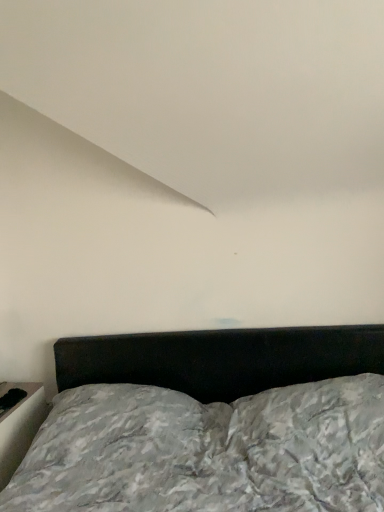
Describe the element at coordinates (211, 423) in the screenshot. I see `textured gray bed at center` at that location.

Measure the distance between textured gray bed at center and camera.

They are 4.44 feet apart.

You are a GUI agent. You are given a task and a screenshot of the screen. Output one action in this format:
    pyautogui.click(x=<x>, y=<y>)
    Task: Click on the textured gray bed at center
    
    Given the screenshot: What is the action you would take?
    pyautogui.click(x=211, y=423)

This screenshot has width=384, height=512. What do you see at coordinates (19, 426) in the screenshot?
I see `white glossy table at lower left` at bounding box center [19, 426].

Identify the location of white glossy table at lower left. This screenshot has width=384, height=512. (19, 426).

The width and height of the screenshot is (384, 512). In order to click on textured gray bed at center in this screenshot , I will do `click(211, 423)`.

Is white glossy table at lower left at the right side of textured gray bed at center?

Incorrect, white glossy table at lower left is not on the right side of textured gray bed at center.

Considering the relative positions of white glossy table at lower left and textured gray bed at center in the image provided, is white glossy table at lower left in front of textured gray bed at center?

No.

Does point (38, 420) come closer to viewer compared to point (344, 354)?

That is False.

From the image's perspective, is white glossy table at lower left over textured gray bed at center?

No, from the image's perspective, white glossy table at lower left is not above textured gray bed at center.

From a real-world perspective, is white glossy table at lower left under textured gray bed at center?

Yes, from a real-world perspective, white glossy table at lower left is beneath textured gray bed at center.

Consider the image. Is white glossy table at lower left wider or thinner than textured gray bed at center?

white glossy table at lower left is thinner than textured gray bed at center.

In terms of height, does white glossy table at lower left look taller or shorter compared to textured gray bed at center?

white glossy table at lower left is shorter than textured gray bed at center.

Between white glossy table at lower left and textured gray bed at center, which one has smaller size?

white glossy table at lower left is smaller.

Is white glossy table at lower left positioned beyond the bounds of textured gray bed at center?

Indeed, white glossy table at lower left is completely outside textured gray bed at center.

Consider the image. Is white glossy table at lower left touching textured gray bed at center?

There is a gap between white glossy table at lower left and textured gray bed at center.

Is white glossy table at lower left oriented towards textured gray bed at center?

No, white glossy table at lower left is not facing towards textured gray bed at center.

Where is `table behind the textured gray bed at center`? The height and width of the screenshot is (512, 384). table behind the textured gray bed at center is located at coordinates point(19,426).

Is textured gray bed at center to the right of white glossy table at lower left from the viewer's perspective?

Indeed, textured gray bed at center is positioned on the right side of white glossy table at lower left.

Between textured gray bed at center and white glossy table at lower left, which one is positioned behind?

Positioned behind is white glossy table at lower left.

Is point (137, 365) closer or farther from the camera than point (0, 429)?

Clearly, point (137, 365) is more distant from the camera than point (0, 429).

From the image's perspective, is textured gray bed at center located above or below white glossy table at lower left?

From the image's perspective, textured gray bed at center appears above white glossy table at lower left.

From a real-world perspective, which is physically above, textured gray bed at center or white glossy table at lower left?

From a 3D spatial view, textured gray bed at center is above.

Between textured gray bed at center and white glossy table at lower left, which one has larger width?

textured gray bed at center is wider.

Can you confirm if textured gray bed at center is taller than white glossy table at lower left?

Yes.

Between textured gray bed at center and white glossy table at lower left, which one has larger size?

Bigger between the two is textured gray bed at center.

Is textured gray bed at center inside or outside of white glossy table at lower left?

The correct answer is: outside.

Is textured gray bed at center not near white glossy table at lower left?

No, there isn't a large distance between textured gray bed at center and white glossy table at lower left.

Is textured gray bed at center oriented towards white glossy table at lower left?

No, textured gray bed at center is not aimed at white glossy table at lower left.

The image size is (384, 512). In order to click on bed above the white glossy table at lower left (from the image's perspective) in this screenshot , I will do `click(211, 423)`.

Find the location of a particular element. table that appears below the textured gray bed at center (from the image's perspective) is located at coordinates (19, 426).

What are the coordinates of `table on the left of textured gray bed at center` in the screenshot? It's located at (x=19, y=426).